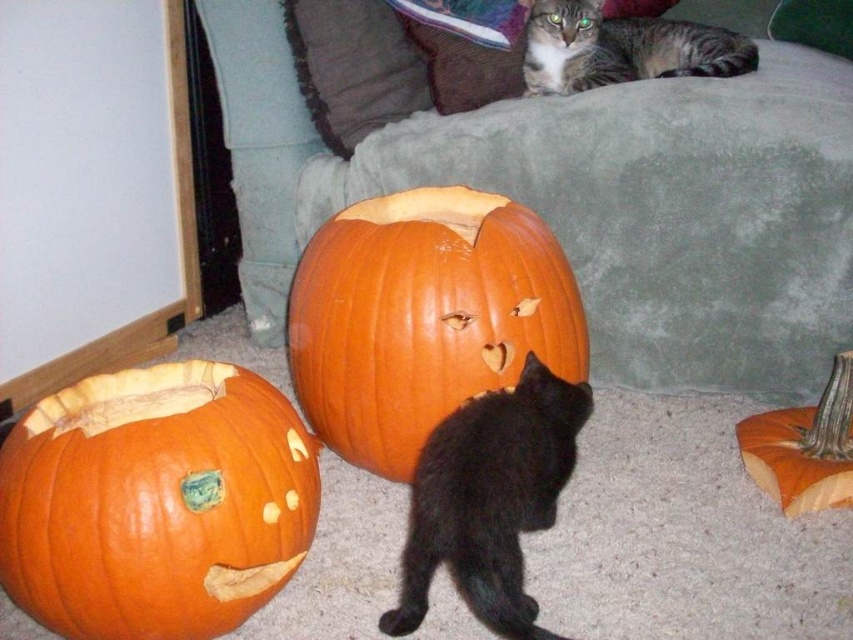
Question: Which of the following is the closest to the observer?

Choices:
 (A) (714, 305)
 (B) (415, 228)
 (C) (82, 422)
 (D) (575, 26)

Answer: (C)

Question: Can you confirm if gray fabric couch at upper center is thinner than black matte/black fur cat at lower center?

Choices:
 (A) yes
 (B) no

Answer: (B)

Question: Considering the real-world distances, which object is closest to the orange matte pumpkin at lower left?

Choices:
 (A) gray fabric couch at upper center
 (B) tabby fur cat at upper center
 (C) black matte/black fur cat at lower center

Answer: (C)

Question: Which of these objects is positioned farthest from the black matte/black fur cat at lower center?

Choices:
 (A) orange matte pumpkin at lower right
 (B) tabby fur cat at upper center
 (C) orange matte pumpkin at lower left

Answer: (B)

Question: Observing the image, what is the correct spatial positioning of gray fabric couch at upper center in reference to black matte/black fur cat at lower center?

Choices:
 (A) above
 (B) below

Answer: (A)

Question: Where is tabby fur cat at upper center located in relation to orange matte pumpkin at lower right in the image?

Choices:
 (A) right
 (B) left

Answer: (B)